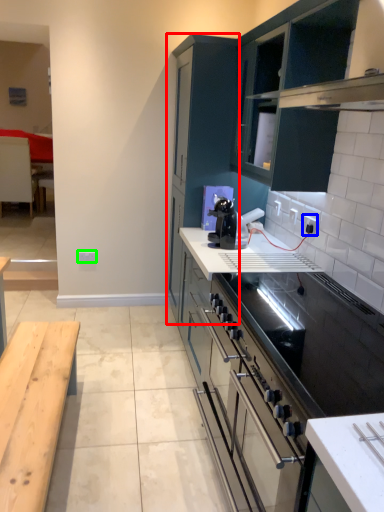
Question: Considering the real-world distances, which object is closest to cabinetry (highlighted by a red box)? electric outlet (highlighted by a blue box) or electric outlet (highlighted by a green box).

Choices:
 (A) electric outlet
 (B) electric outlet

Answer: (A)